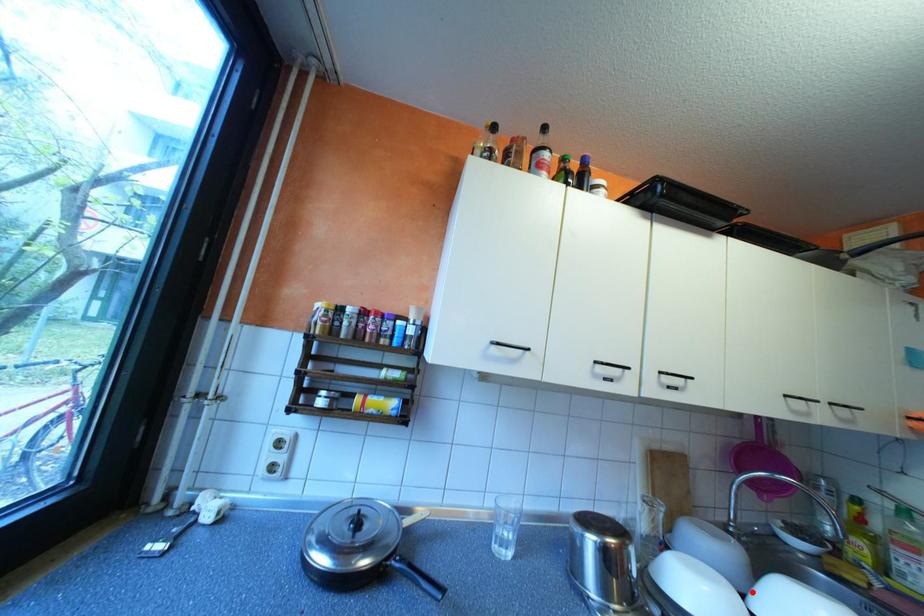
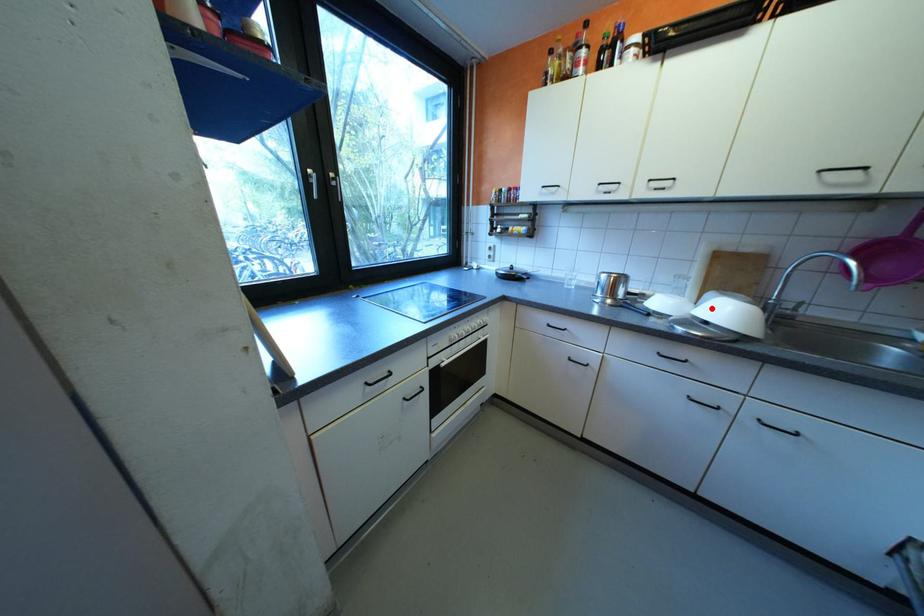
I am providing you with two images of the same scene from different viewpoints. A red point is marked on the first image and another point is marked on the second image. Are the points marked in image1 and image2 representing the same 3D position?

Yes